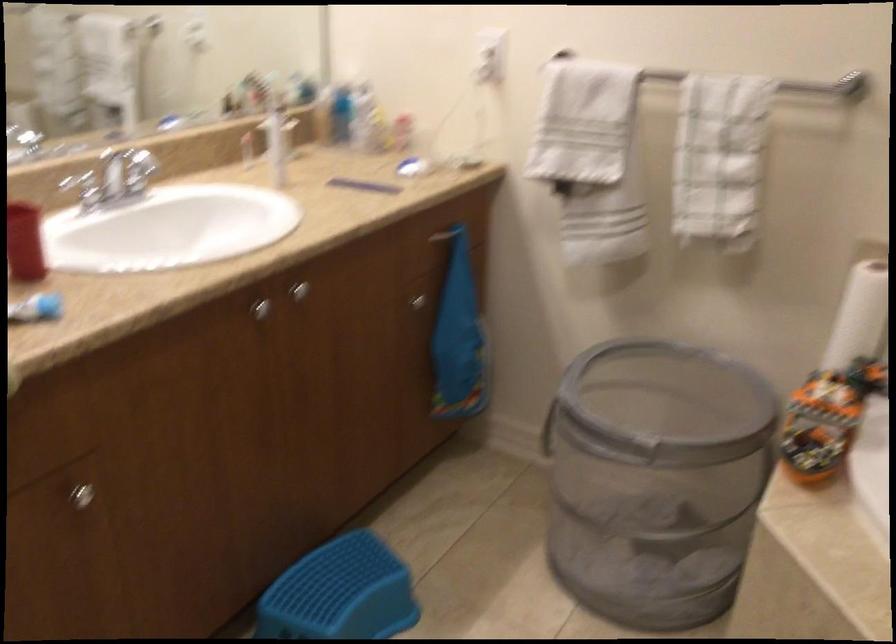
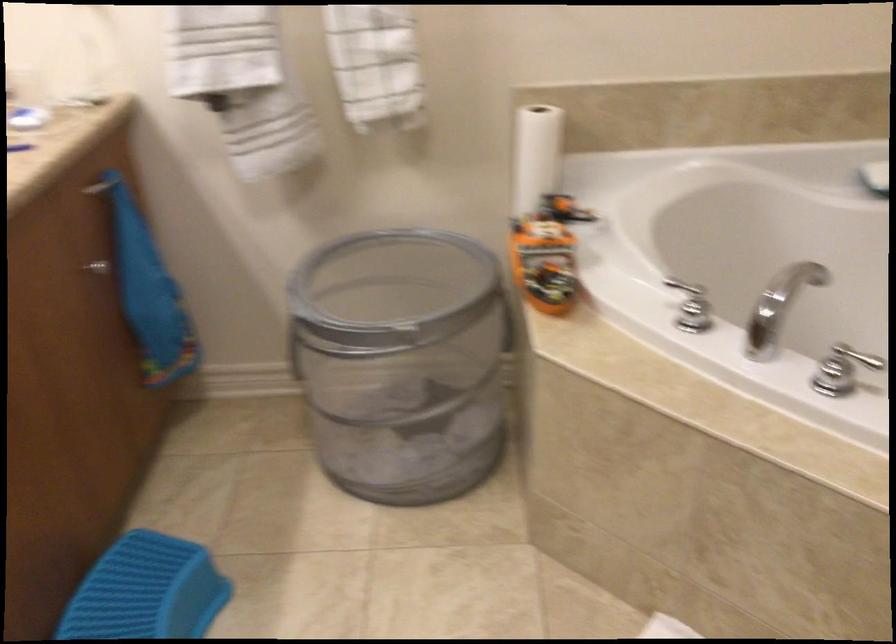
Locate, in the second image, the point that corresponds to (825,421) in the first image.

(547, 252)